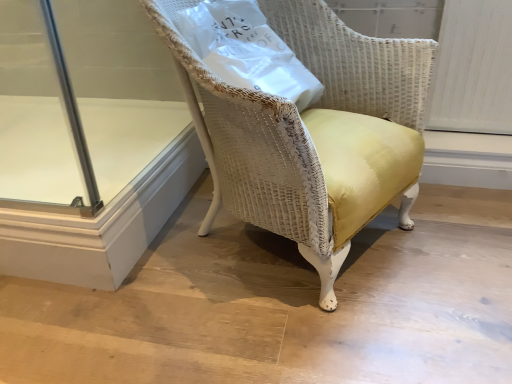
Question: Can you confirm if transparent glass door at lower left is positioned to the left of yellow fabric chair at center?

Choices:
 (A) yes
 (B) no

Answer: (A)

Question: From the image's perspective, does transparent glass door at lower left appear lower than yellow fabric chair at center?

Choices:
 (A) no
 (B) yes

Answer: (B)

Question: Does transparent glass door at lower left come behind yellow fabric chair at center?

Choices:
 (A) yes
 (B) no

Answer: (A)

Question: From the image's perspective, is transparent glass door at lower left on top of yellow fabric chair at center?

Choices:
 (A) yes
 (B) no

Answer: (B)

Question: Is transparent glass door at lower left far from yellow fabric chair at center?

Choices:
 (A) yes
 (B) no

Answer: (B)

Question: Does transparent glass door at lower left contain yellow fabric chair at center?

Choices:
 (A) no
 (B) yes

Answer: (A)

Question: Is white paper bag at upper center oriented towards transparent glass door at lower left?

Choices:
 (A) yes
 (B) no

Answer: (B)

Question: Does white paper bag at upper center appear on the left side of transparent glass door at lower left?

Choices:
 (A) yes
 (B) no

Answer: (B)

Question: Does white paper bag at upper center lie in front of transparent glass door at lower left?

Choices:
 (A) yes
 (B) no

Answer: (A)

Question: Would you say white paper bag at upper center is a long distance from transparent glass door at lower left?

Choices:
 (A) no
 (B) yes

Answer: (A)

Question: From a real-world perspective, is white paper bag at upper center physically above transparent glass door at lower left?

Choices:
 (A) yes
 (B) no

Answer: (A)

Question: Is white paper bag at upper center shorter than transparent glass door at lower left?

Choices:
 (A) yes
 (B) no

Answer: (B)

Question: From the image's perspective, is yellow fabric chair at center beneath white paper bag at upper center?

Choices:
 (A) no
 (B) yes

Answer: (B)